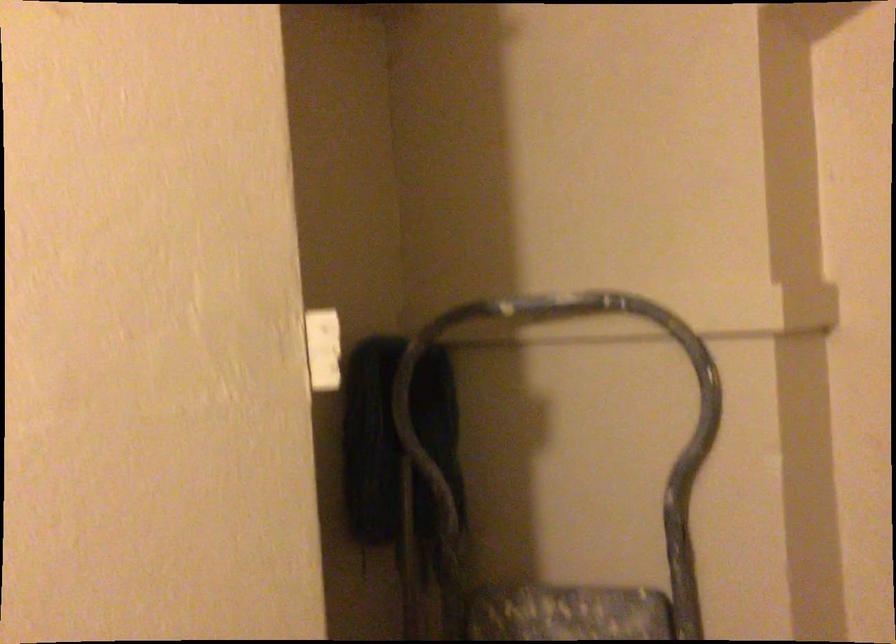
Describe the element at coordinates (582, 424) in the screenshot. The height and width of the screenshot is (644, 896). I see `the ladder top rail` at that location.